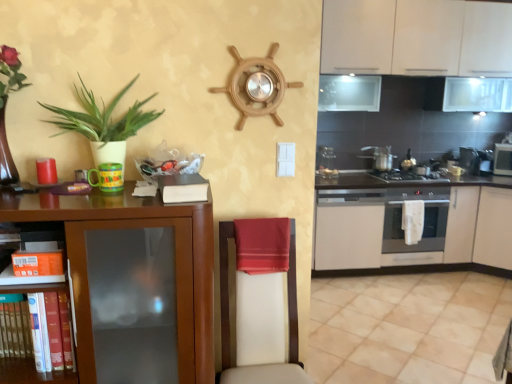
Question: Which direction should I rotate to face silver metallic pot at center, which is the 4th appliance in right-to-left order, — up or down?

Choices:
 (A) down
 (B) up

Answer: (B)

Question: Is beige ceramic tile at lower right in contact with stainless steel oven at center right?

Choices:
 (A) yes
 (B) no

Answer: (B)

Question: Does beige ceramic tile at lower right have a lesser width compared to stainless steel oven at center right?

Choices:
 (A) no
 (B) yes

Answer: (A)

Question: Is beige ceramic tile at lower right far from stainless steel oven at center right?

Choices:
 (A) yes
 (B) no

Answer: (B)

Question: Is beige ceramic tile at lower right taller than stainless steel oven at center right?

Choices:
 (A) yes
 (B) no

Answer: (B)

Question: From the image's perspective, is beige ceramic tile at lower right on stainless steel oven at center right?

Choices:
 (A) yes
 (B) no

Answer: (B)

Question: From a real-world perspective, is beige ceramic tile at lower right located beneath stainless steel oven at center right?

Choices:
 (A) yes
 (B) no

Answer: (A)

Question: Is white matte cabinet at lower right, which appears as the 4th cabinetry when viewed from the front, positioned far away from orange cardboard box at lower left?

Choices:
 (A) no
 (B) yes

Answer: (B)

Question: Considering the relative positions of white matte cabinet at lower right, positioned as the 1th cabinetry in back-to-front order, and orange cardboard box at lower left in the image provided, is white matte cabinet at lower right, positioned as the 1th cabinetry in back-to-front order, to the right of orange cardboard box at lower left from the viewer's perspective?

Choices:
 (A) yes
 (B) no

Answer: (A)

Question: Is white matte cabinet at lower right, which appears as the 4th cabinetry when viewed from the front, wider than orange cardboard box at lower left?

Choices:
 (A) yes
 (B) no

Answer: (A)

Question: Is white matte cabinet at lower right, positioned as the 1th cabinetry in back-to-front order, in front of orange cardboard box at lower left?

Choices:
 (A) no
 (B) yes

Answer: (A)

Question: Does white matte cabinet at lower right, positioned as the 1th cabinetry in back-to-front order, have a larger size compared to orange cardboard box at lower left?

Choices:
 (A) yes
 (B) no

Answer: (A)

Question: Could you tell me if white matte cabinet at lower right, positioned as the 1th cabinetry in back-to-front order, is facing orange cardboard box at lower left?

Choices:
 (A) no
 (B) yes

Answer: (A)

Question: Considering the relative sizes of metallic silver gas stove at center and stainless steel oven at right, arranged as the second appliance when viewed from the right, in the image provided, is metallic silver gas stove at center bigger than stainless steel oven at right, arranged as the second appliance when viewed from the right,?

Choices:
 (A) yes
 (B) no

Answer: (A)